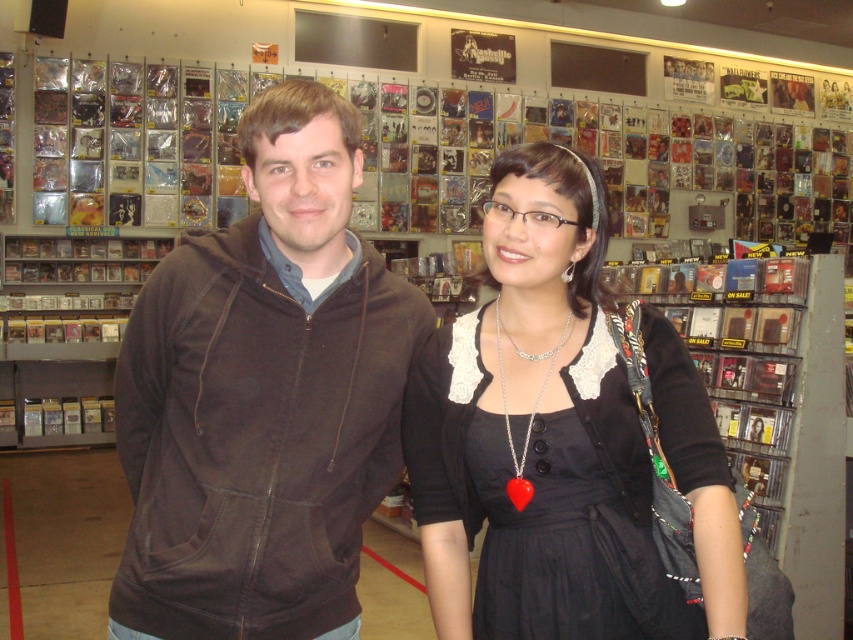
You are a photographer taking a picture of the brown cotton hoodie at left and the black lace dress at center. Which one is positioned higher in the frame?

The brown cotton hoodie at left is positioned higher in the frame than the black lace dress at center.

Looking at this image, you are a photographer setting up for a photoshoot in a music store. You have two subjects wearing the brown cotton hoodie at left and the black lace dress at center. Based on their clothing sizes, which subject should you position closer to the camera to ensure both appear proportionally sized in the final image?

The brown cotton hoodie at left is larger in size than the black lace dress at center. To make both appear proportionally sized, position the person wearing the brown cotton hoodie at left farther from the camera and the person in the black lace dress at center closer to the camera. This adjustment will balance their sizes in the photo.

You are a photographer setting up for a group photo in a music store. You notice the brown cotton hoodie at left and the black lace dress at center. Which clothing item is closer to the camera?

The brown cotton hoodie at left is closer to the camera because the black lace dress at center is positioned behind it.